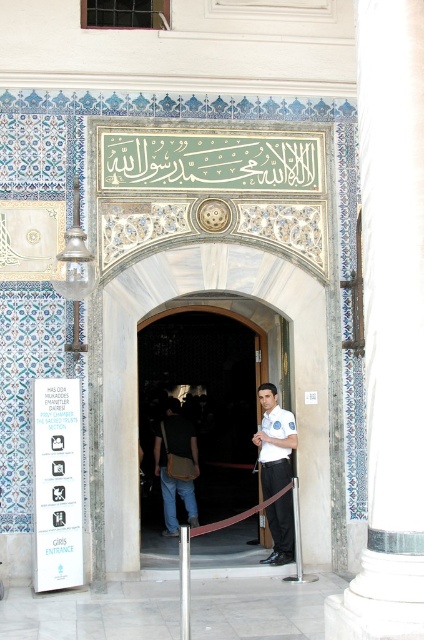
You are a visitor approaching the entrance of the historical building. You see the wooden door at center and the white uniform at center. Which object is positioned higher from the ground?

The wooden door at center is positioned higher from the ground than the white uniform at center because the wooden door at center is above white uniform at center.

You are standing at the entrance of the historical building and want to open the wooden door at center. Based on its position coordinates, is the door closer to the top or bottom of the entrance area?

The wooden door at center is positioned at coordinates point (206,400). Since the y coordinate is 0.488, which is closer to 0.5, the door is centrally located vertically, so it is neither closer to the top nor the bottom of the entrance area.